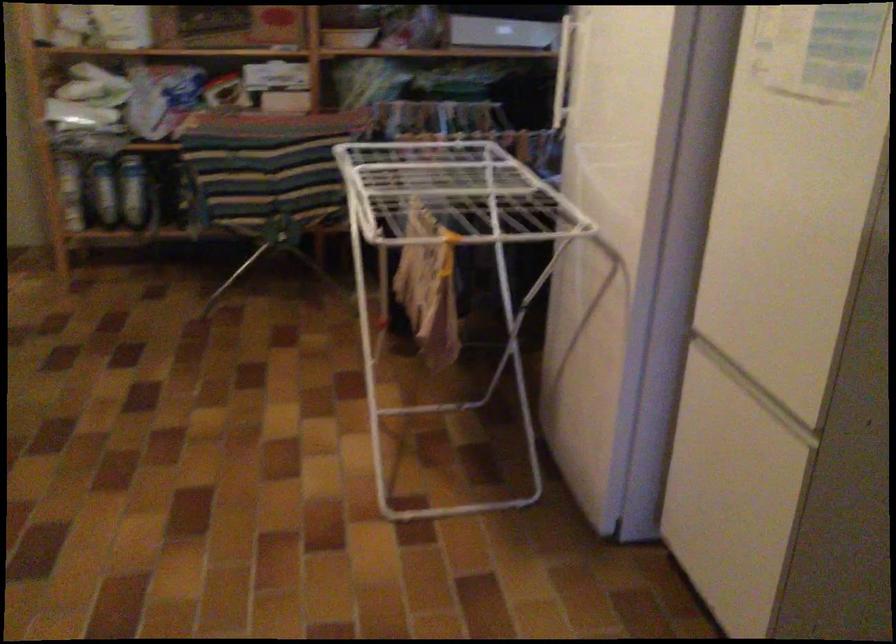
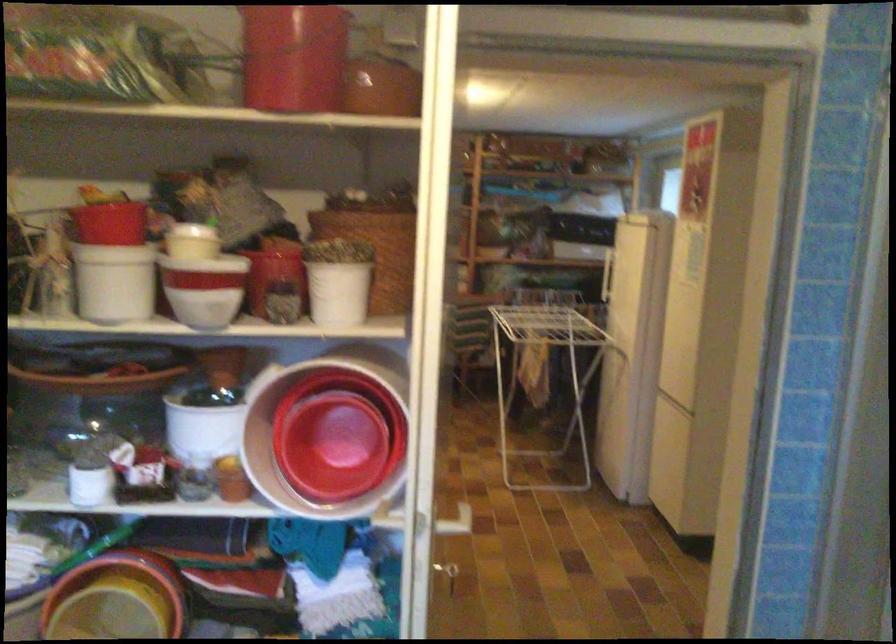
Question: I am providing you with two images of the same scene from different viewpoints. Please identify which objects are invisible in image2.

Choices:
 (A) blue bottle
 (B) black ice bucket
 (C) small white pot
 (D) small red pot

Answer: (A)